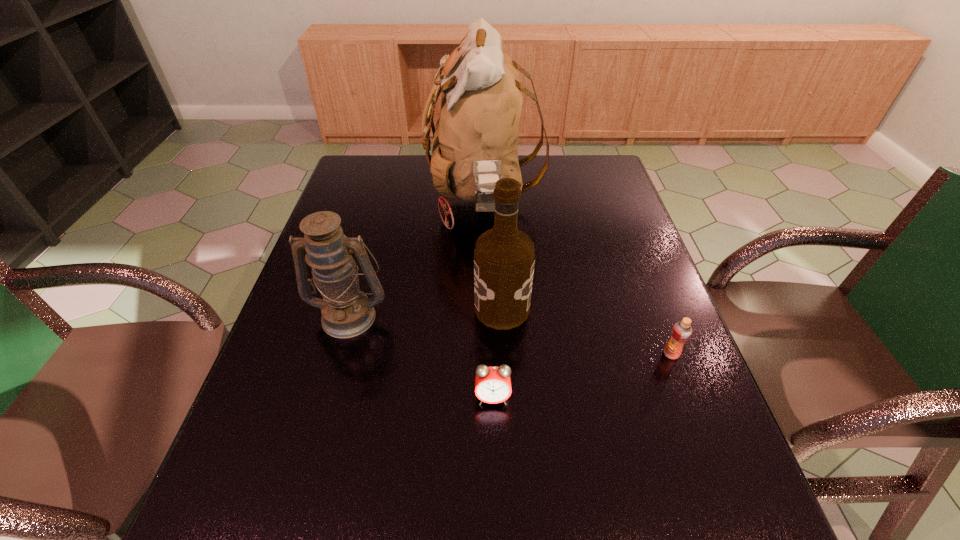
Identify the location of the farthest object. The image size is (960, 540). (475, 144).

Where is `the tallest object`? the tallest object is located at coordinates (475, 144).

The height and width of the screenshot is (540, 960). I want to click on alcohol, so click(504, 258).

Where is `the leftmost object`? the leftmost object is located at coordinates (346, 311).

Image resolution: width=960 pixels, height=540 pixels. Find the location of `oil lamp`. oil lamp is located at coordinates (346, 311).

Identify the location of the fourth farthest object. (681, 332).

Image resolution: width=960 pixels, height=540 pixels. Find the location of `the rightmost object`. the rightmost object is located at coordinates (681, 332).

Find the location of a particular element. The image size is (960, 540). the nearest object is located at coordinates (492, 384).

This screenshot has width=960, height=540. In order to click on alarm clock in this screenshot , I will do `click(492, 384)`.

Locate an element on the screen. The width and height of the screenshot is (960, 540). free space located 0.280m on the front-facing side of the farthest object is located at coordinates (336, 202).